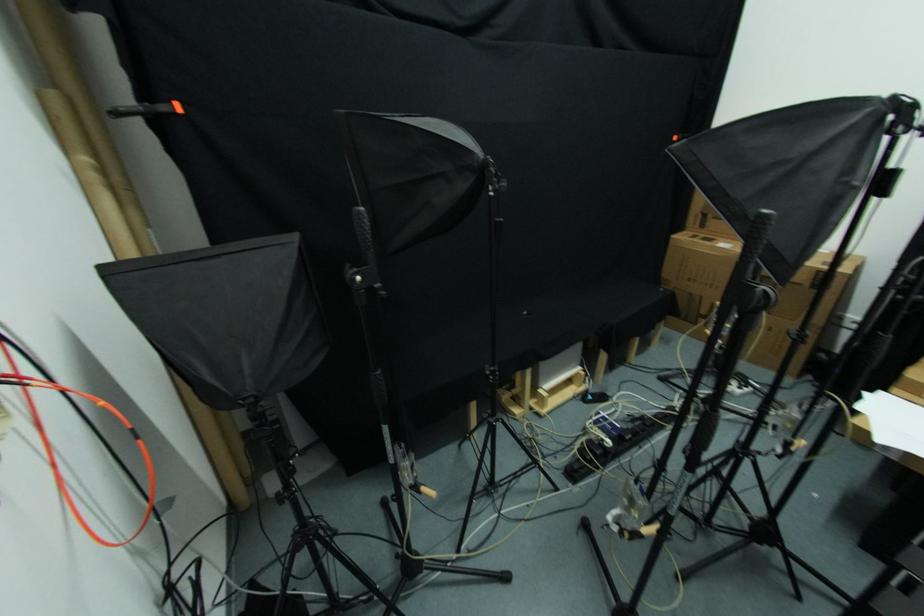
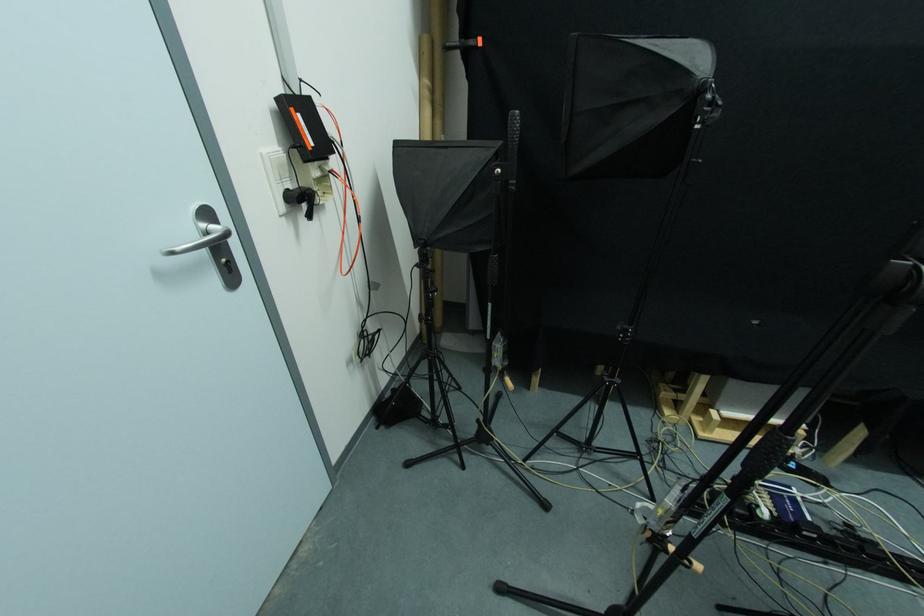
The point at (382, 292) is marked in the first image. Where is the corresponding point in the second image?

(515, 187)